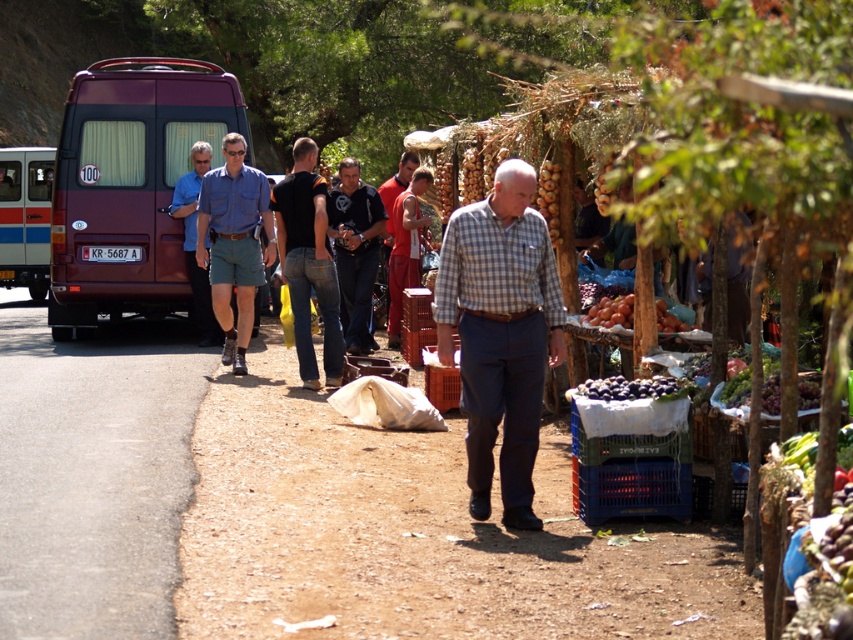
Question: Which point appears farthest from the camera in this image?

Choices:
 (A) (200, 340)
 (B) (321, 193)
 (C) (236, 237)
 (D) (344, 218)

Answer: (A)

Question: Is shiny purple plums at center smaller than red cotton t-shirt at center?

Choices:
 (A) yes
 (B) no

Answer: (A)

Question: Does maroon matte van at left appear on the left side of black denim jeans at center?

Choices:
 (A) yes
 (B) no

Answer: (A)

Question: Which object appears farthest from the camera in this image?

Choices:
 (A) shiny purple grapes at center
 (B) shiny purple plums at center
 (C) matte red van at left

Answer: (C)

Question: Among these objects, which one is farthest from the camera?

Choices:
 (A) blue shirt at center
 (B) red cotton t-shirt at center
 (C) checkered fabric shirt at center

Answer: (B)

Question: Does checkered fabric shirt at center appear on the right side of matte red van at left?

Choices:
 (A) yes
 (B) no

Answer: (A)